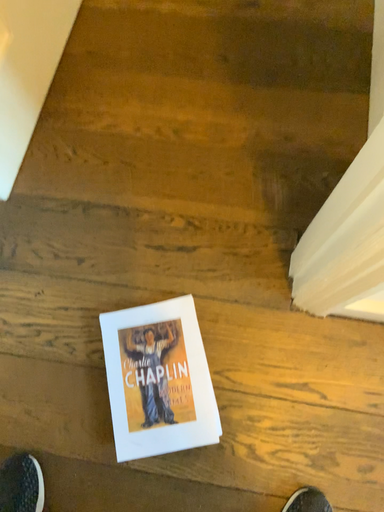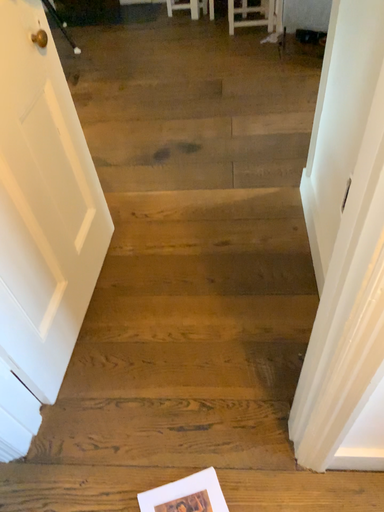
Question: Which way did the camera rotate in the video?

Choices:
 (A) rotated upward
 (B) rotated downward

Answer: (A)